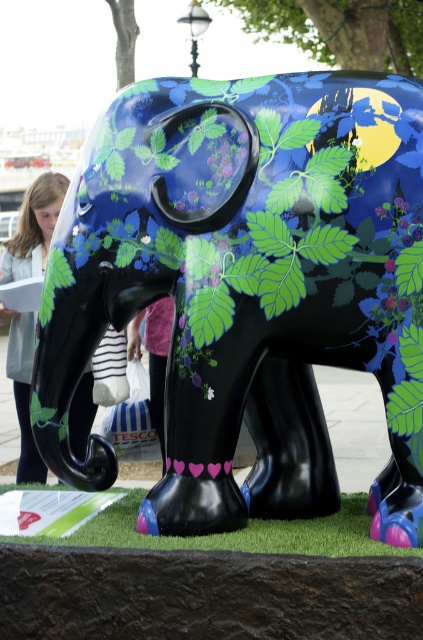
You are standing at the base of the elephant sculpture and want to walk to a specific point. If you move towards the point labeled point (57, 186), will you pass by the point labeled point (334, 221) first?

Point (334, 221) is in front of point (57, 186), so yes, you will pass by point (334, 221) first when moving towards point (57, 186).